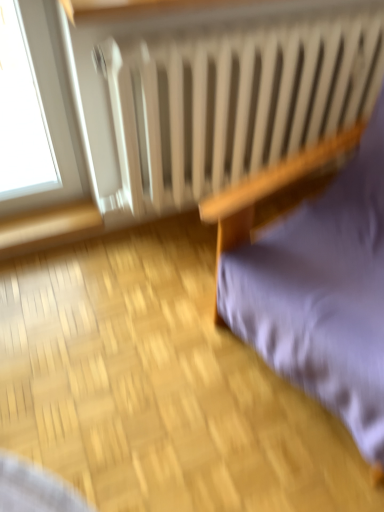
Find the location of a particular element. Image resolution: width=384 pixels, height=512 pixels. free space above white matte radiator at upper center (from a real-world perspective) is located at coordinates (269, 26).